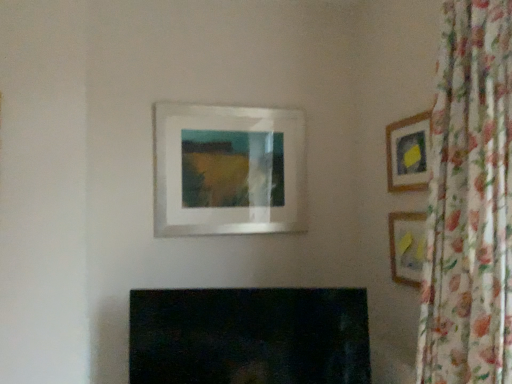
Question: Does matte glass picture frame at center, positioned as the 3th picture frame in right-to-left order, have a lesser height compared to wooden frame at right, which is the 3th picture frame in left-to-right order?

Choices:
 (A) no
 (B) yes

Answer: (A)

Question: Is matte glass picture frame at center, positioned as the 3th picture frame in right-to-left order, at the right side of wooden frame at right, which is the 3th picture frame in left-to-right order?

Choices:
 (A) yes
 (B) no

Answer: (B)

Question: Can wooden frame at right, which appears as the 1th picture frame when viewed from the right, be found inside matte glass picture frame at center, positioned as the first picture frame in left-to-right order?

Choices:
 (A) yes
 (B) no

Answer: (B)

Question: Considering the relative sizes of matte glass picture frame at center, positioned as the first picture frame in left-to-right order, and wooden frame at right, which appears as the 1th picture frame when viewed from the right, in the image provided, is matte glass picture frame at center, positioned as the first picture frame in left-to-right order, bigger than wooden frame at right, which appears as the 1th picture frame when viewed from the right,?

Choices:
 (A) yes
 (B) no

Answer: (A)

Question: Does matte glass picture frame at center, positioned as the first picture frame in left-to-right order, come behind wooden frame at right, which is the 3th picture frame in left-to-right order?

Choices:
 (A) no
 (B) yes

Answer: (B)

Question: From a real-world perspective, is matte glass picture frame at center, positioned as the first picture frame in left-to-right order, below wooden frame at right, which is the 3th picture frame in left-to-right order?

Choices:
 (A) yes
 (B) no

Answer: (B)

Question: Is wooden frame at upper right, which appears as the second picture frame when viewed from the left, not inside floral fabric curtain at right?

Choices:
 (A) no
 (B) yes

Answer: (B)

Question: Can you confirm if wooden frame at upper right, the 2th picture frame when ordered from right to left, is positioned to the left of floral fabric curtain at right?

Choices:
 (A) yes
 (B) no

Answer: (B)

Question: From the image's perspective, is wooden frame at upper right, which appears as the second picture frame when viewed from the left, beneath floral fabric curtain at right?

Choices:
 (A) yes
 (B) no

Answer: (B)

Question: From the image's perspective, is wooden frame at upper right, which appears as the second picture frame when viewed from the left, located above floral fabric curtain at right?

Choices:
 (A) no
 (B) yes

Answer: (B)

Question: Is wooden frame at upper right, the 2th picture frame when ordered from right to left, in front of floral fabric curtain at right?

Choices:
 (A) yes
 (B) no

Answer: (B)

Question: Is wooden frame at upper right, the 2th picture frame when ordered from right to left, thinner than floral fabric curtain at right?

Choices:
 (A) no
 (B) yes

Answer: (B)

Question: Does floral fabric curtain at right have a greater width compared to matte glass picture frame at center, positioned as the first picture frame in left-to-right order?

Choices:
 (A) no
 (B) yes

Answer: (B)